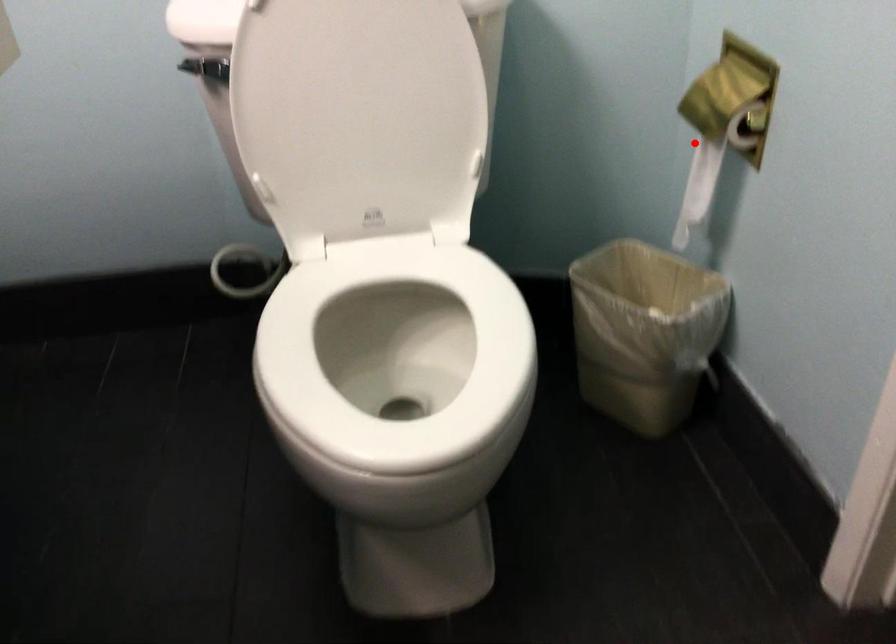
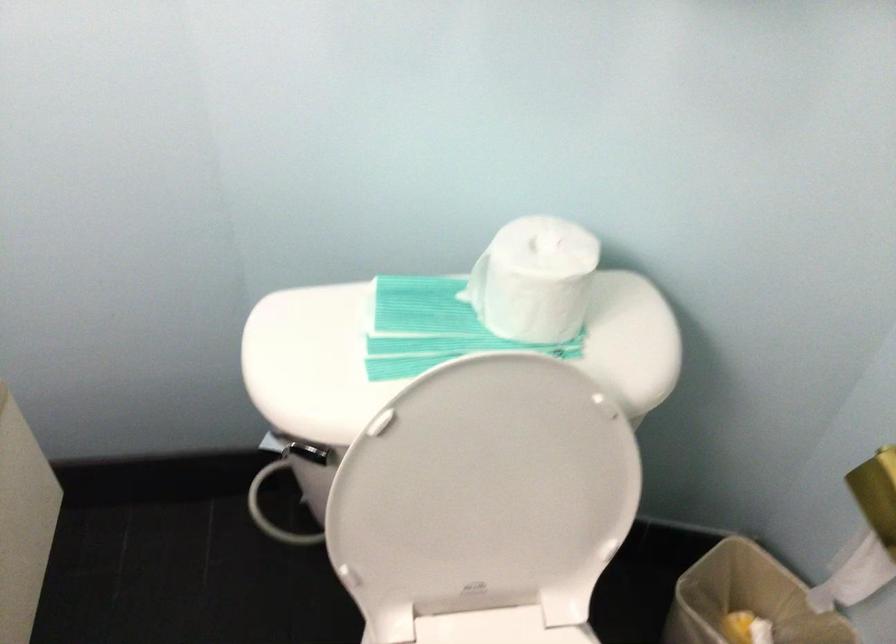
Question: I am providing you with two images of the same scene from different viewpoints. Given a red point in image1, look at the same physical point in image2. Is it:

Choices:
 (A) Closer to the viewpoint
 (B) Farther from the viewpoint

Answer: (A)